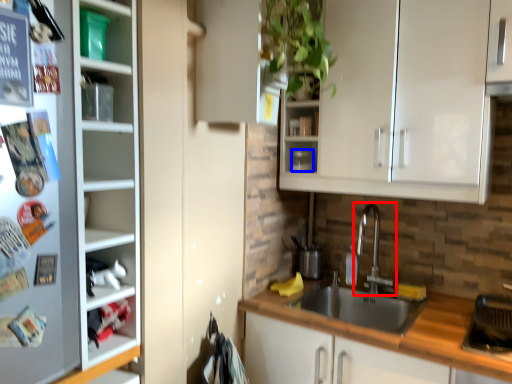
Question: Which object is further to the camera taking this photo, tap (highlighted by a red box) or appliance (highlighted by a blue box)?

Choices:
 (A) tap
 (B) appliance

Answer: (B)